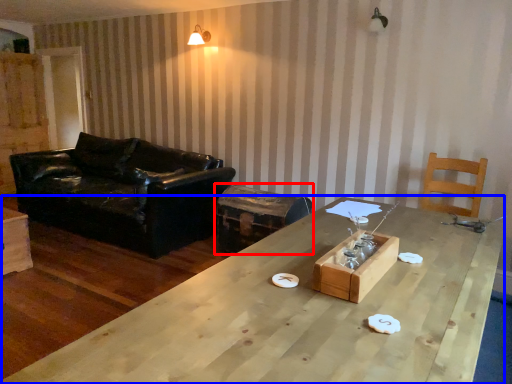
Question: Which point is further to the camera, swivel chair (highlighted by a red box) or table (highlighted by a blue box)?

Choices:
 (A) swivel chair
 (B) table

Answer: (A)